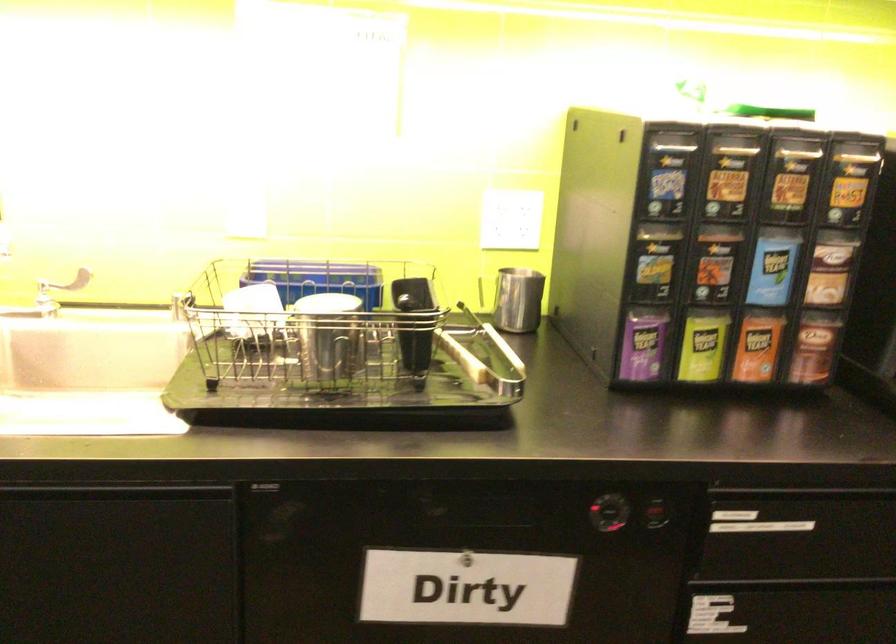
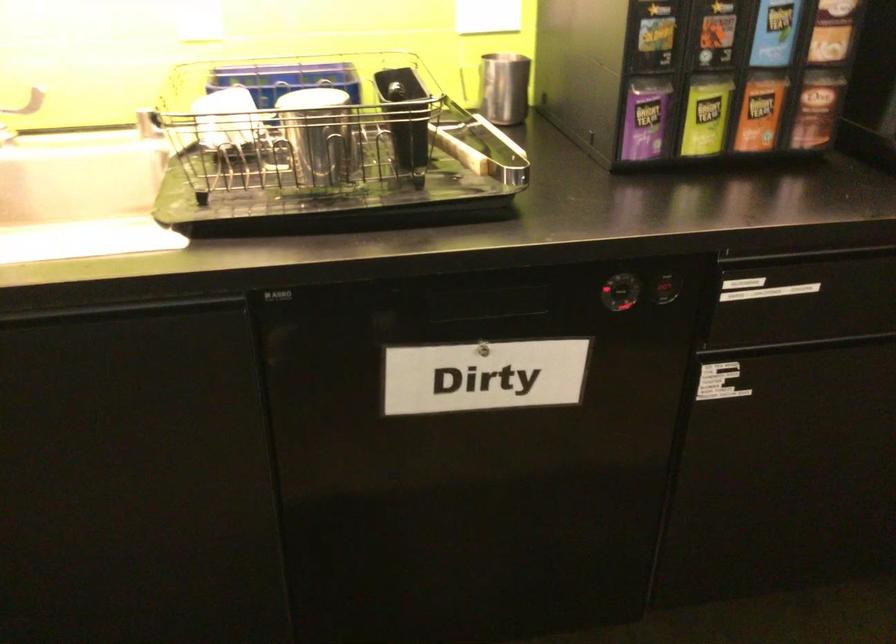
Find the pixel in the second image that matches point (813, 348) in the first image.

(816, 109)